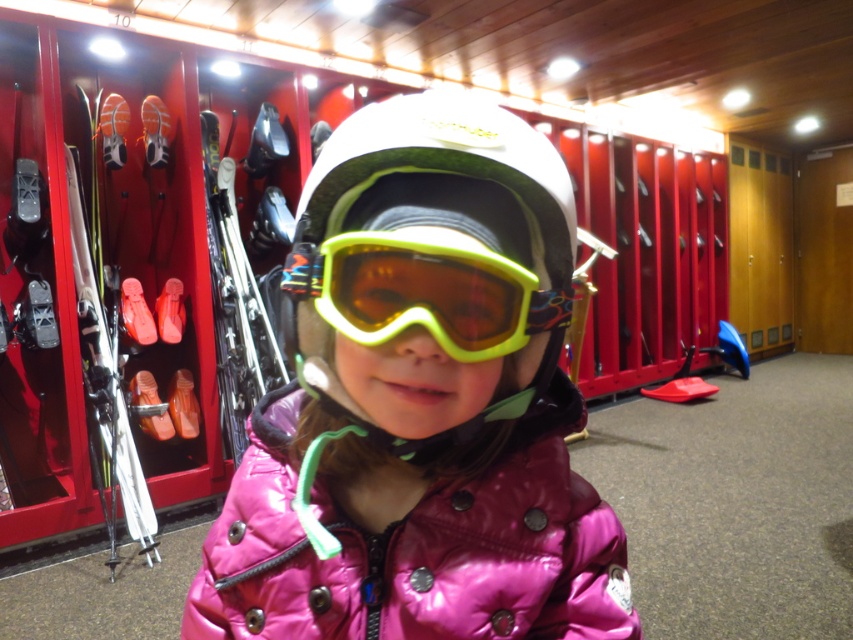
Is point (352, 372) more distant than point (399, 609)?

That is False.

Measure the distance from pink glossy jacket at center to pink shiny jacket at center.

1.18 inches

What do you see at coordinates (421, 403) in the screenshot? I see `pink glossy jacket at center` at bounding box center [421, 403].

Where is `pink glossy jacket at center`? Image resolution: width=853 pixels, height=640 pixels. pink glossy jacket at center is located at coordinates (421, 403).

Between white matte helmet at center and shiny metallic skis at left, which one is positioned higher?

shiny metallic skis at left

Does white matte helmet at center appear under shiny metallic skis at left?

Correct, white matte helmet at center is located below shiny metallic skis at left.

Between point (303, 195) and point (138, 508), which one is positioned in front?

Point (303, 195)

Identify the location of white matte helmet at center. (445, 168).

Can you confirm if pink glossy jacket at center is positioned to the left of shiny metallic skis at left?

No, pink glossy jacket at center is not to the left of shiny metallic skis at left.

Is point (350, 216) farther from viewer compared to point (103, 356)?

That is False.

Find the location of a particular element. pink glossy jacket at center is located at coordinates (421, 403).